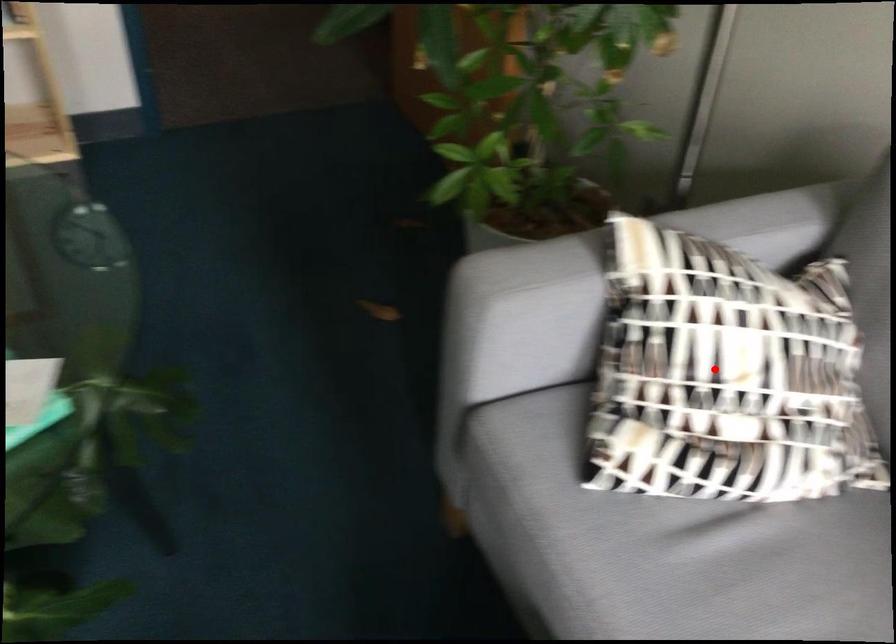
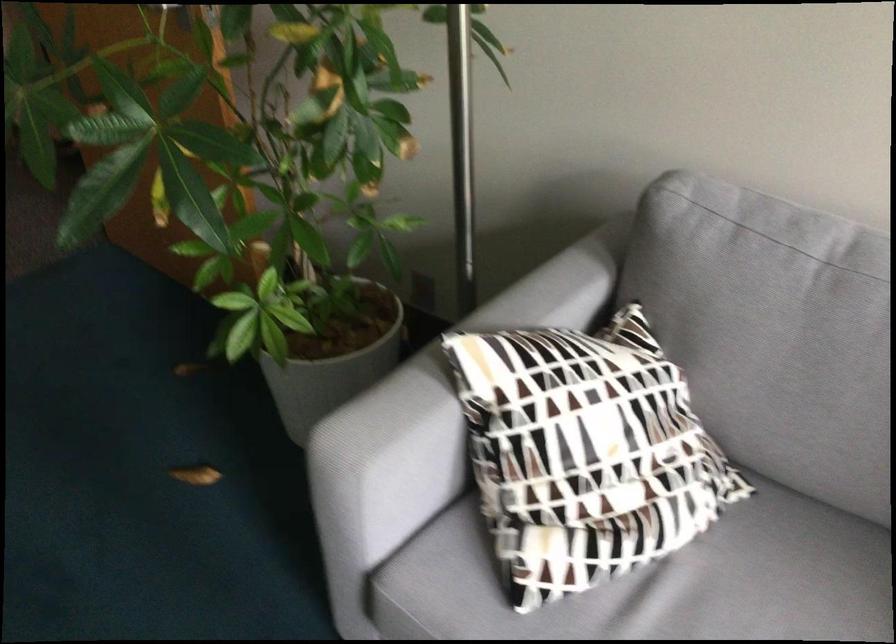
In the second image, find the point that corresponds to the highlighted location in the first image.

(583, 453)